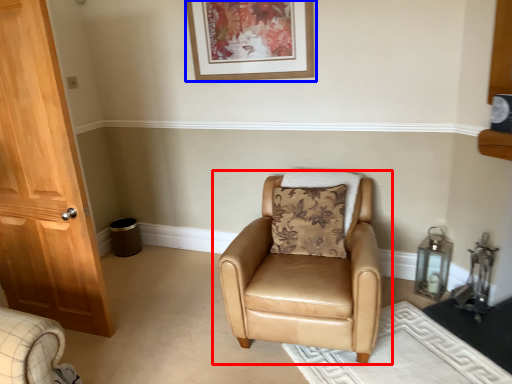
Question: Which point is further to the camera, chair (highlighted by a red box) or picture frame (highlighted by a blue box)?

Choices:
 (A) chair
 (B) picture frame

Answer: (B)